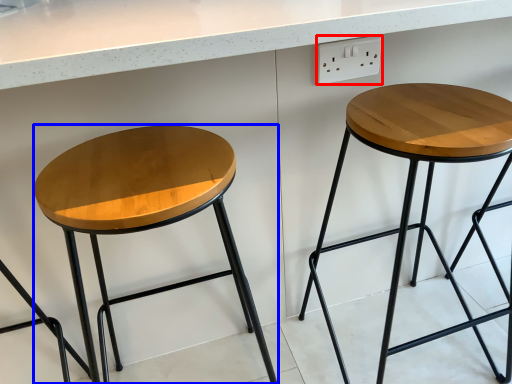
Question: Which object appears closest to the camera in this image, electric outlet (highlighted by a red box) or stool (highlighted by a blue box)?

Choices:
 (A) electric outlet
 (B) stool

Answer: (B)